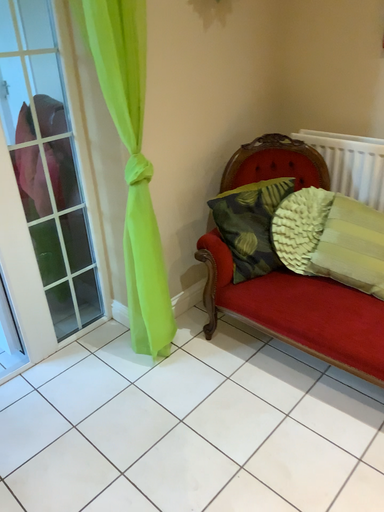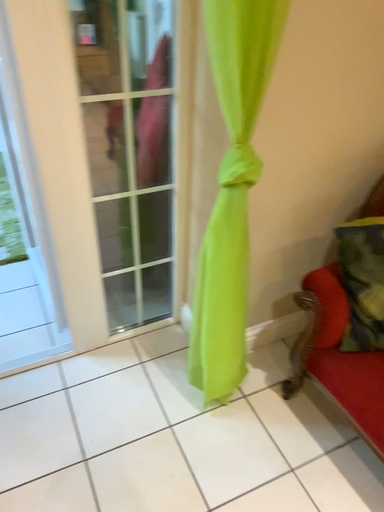
Question: How did the camera likely rotate when shooting the video?

Choices:
 (A) rotated right
 (B) rotated left

Answer: (B)